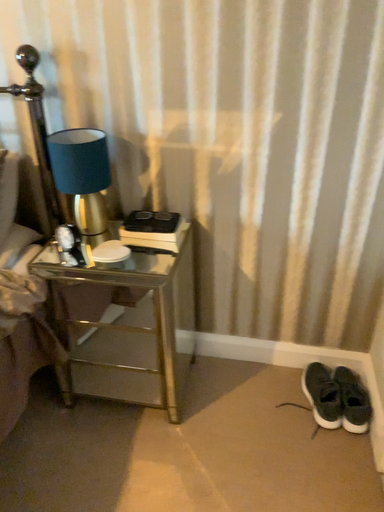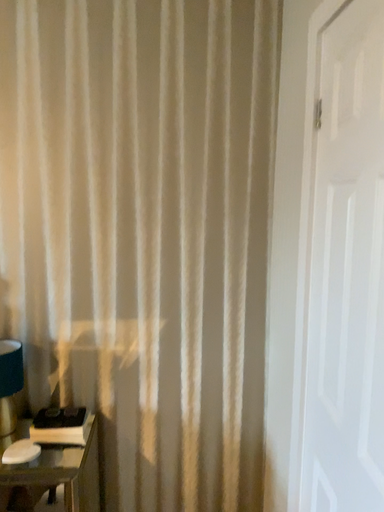
Question: Which way did the camera rotate in the video?

Choices:
 (A) rotated left
 (B) rotated right

Answer: (B)